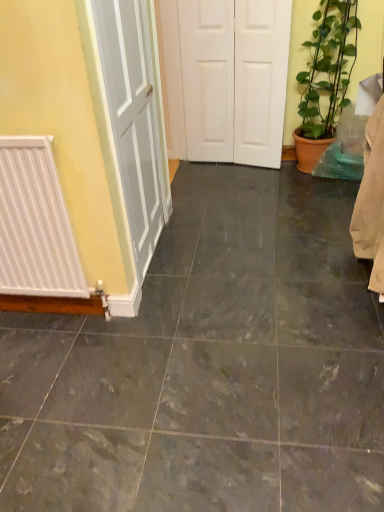
Question: Can you confirm if white matte door at center is smaller than marble tile at center?

Choices:
 (A) no
 (B) yes

Answer: (B)

Question: Is white matte door at center positioned in front of marble tile at center?

Choices:
 (A) yes
 (B) no

Answer: (B)

Question: From a real-world perspective, is white matte door at center on top of marble tile at center?

Choices:
 (A) yes
 (B) no

Answer: (A)

Question: Could you tell me if white matte door at center is facing marble tile at center?

Choices:
 (A) yes
 (B) no

Answer: (A)

Question: Is white matte door at center next to marble tile at center and touching it?

Choices:
 (A) no
 (B) yes

Answer: (A)

Question: From the image's perspective, is white matte door at center on top of marble tile at center?

Choices:
 (A) yes
 (B) no

Answer: (A)

Question: Is marble tile at center at the left side of white matte radiator at left?

Choices:
 (A) no
 (B) yes

Answer: (A)

Question: Is the depth of marble tile at center greater than that of white matte radiator at left?

Choices:
 (A) yes
 (B) no

Answer: (B)

Question: From a real-world perspective, is marble tile at center on top of white matte radiator at left?

Choices:
 (A) no
 (B) yes

Answer: (A)

Question: Is marble tile at center bigger than white matte radiator at left?

Choices:
 (A) yes
 (B) no

Answer: (A)

Question: From the image's perspective, is marble tile at center beneath white matte radiator at left?

Choices:
 (A) no
 (B) yes

Answer: (B)

Question: Can you confirm if marble tile at center is positioned to the right of white matte radiator at left?

Choices:
 (A) no
 (B) yes

Answer: (B)

Question: From a real-world perspective, is marble tile at center physically below green leafy plant at right?

Choices:
 (A) yes
 (B) no

Answer: (A)